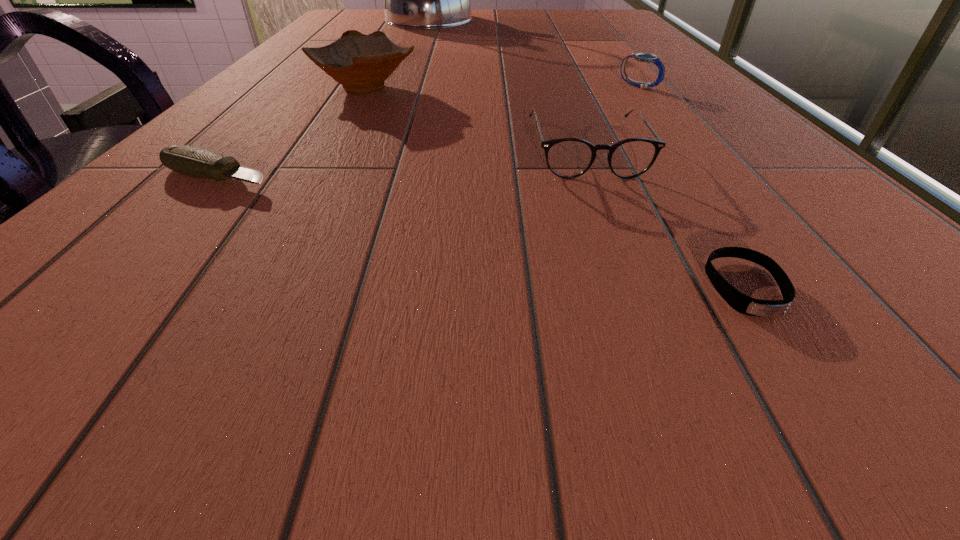
Find the location of a particular element. the tallest object is located at coordinates (413, 0).

Find the location of a particular element. The width and height of the screenshot is (960, 540). kettle is located at coordinates (413, 0).

The image size is (960, 540). In order to click on the second tallest object in this screenshot , I will do `click(361, 63)`.

Locate an element on the screen. This screenshot has height=540, width=960. watch is located at coordinates (642, 57).

Image resolution: width=960 pixels, height=540 pixels. I want to click on spectacles, so click(x=567, y=158).

The height and width of the screenshot is (540, 960). In order to click on pocketknife in this screenshot , I will do `click(193, 161)`.

Locate an element on the screen. Image resolution: width=960 pixels, height=540 pixels. the nearest object is located at coordinates tap(740, 302).

Locate an element on the screen. This screenshot has height=540, width=960. the shortest object is located at coordinates (740, 302).

The width and height of the screenshot is (960, 540). I want to click on free spot located from the spout of the kettle, so pos(563,19).

At what (x,y) coordinates should I click in order to perform the action: click on free space located 0.180m on the front of the fifth shortest object. Please return your answer as a coordinate pair (x, y). The image size is (960, 540). Looking at the image, I should click on (327, 151).